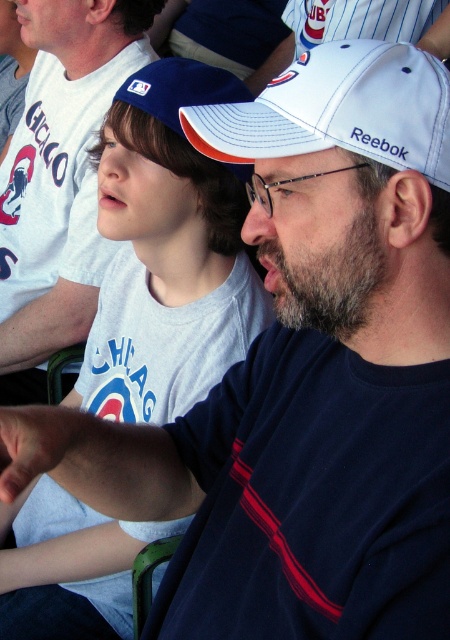
This screenshot has height=640, width=450. Describe the element at coordinates (166, 253) in the screenshot. I see `white cotton shirt at upper left` at that location.

Which is more to the left, white cotton shirt at upper left or white matte baseball cap at center?

white cotton shirt at upper left is more to the left.

Does point (125, 602) lie behind point (382, 93)?

Yes.

Find the location of `white cotton shirt at upper left`. white cotton shirt at upper left is located at coordinates (166, 253).

In the scene shown: Who is more forward, (135, 324) or (58, 74)?

Point (135, 324)

Between white cotton shirt at upper left and white matte baseball cap at upper center, which one appears on the right side from the viewer's perspective?

white cotton shirt at upper left is more to the right.

Is point (120, 584) in front of point (48, 352)?

That is True.

This screenshot has width=450, height=640. I want to click on white cotton shirt at upper left, so click(166, 253).

Which is below, white matte baseball cap at upper center or white matte baseball cap at center?

white matte baseball cap at center

Is white matte baseball cap at upper center to the right of white matte baseball cap at center from the viewer's perspective?

No, white matte baseball cap at upper center is not to the right of white matte baseball cap at center.

Locate an element on the screen. The height and width of the screenshot is (640, 450). white matte baseball cap at upper center is located at coordinates (59, 179).